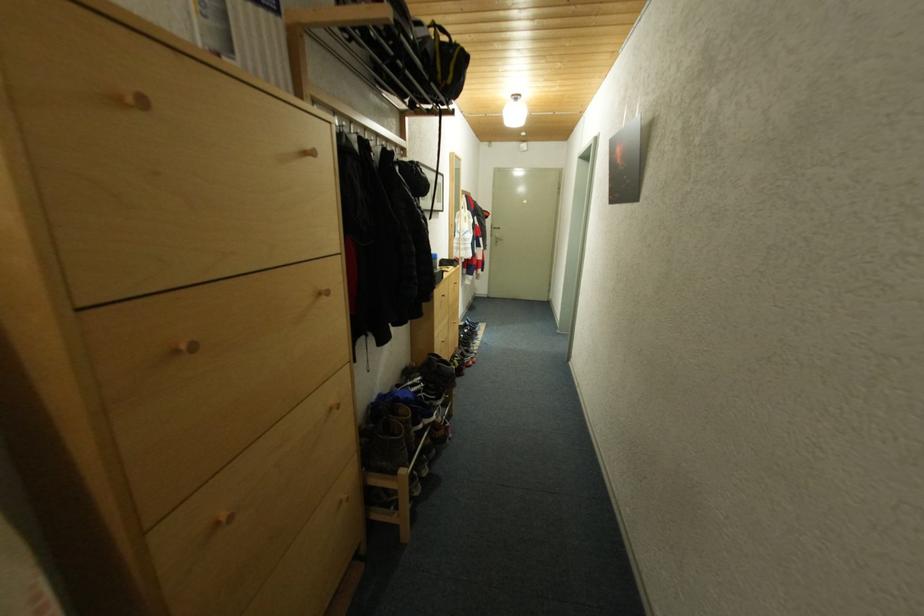
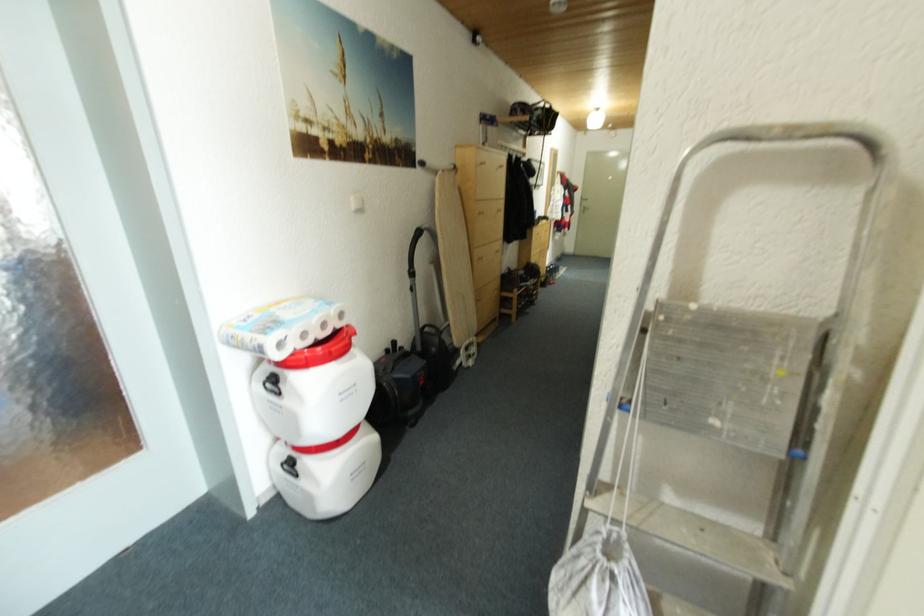
Question: The images are taken continuously from a first-person perspective. In which direction are you moving?

Choices:
 (A) Left
 (B) Right
 (C) Forward
 (D) Backward

Answer: (D)